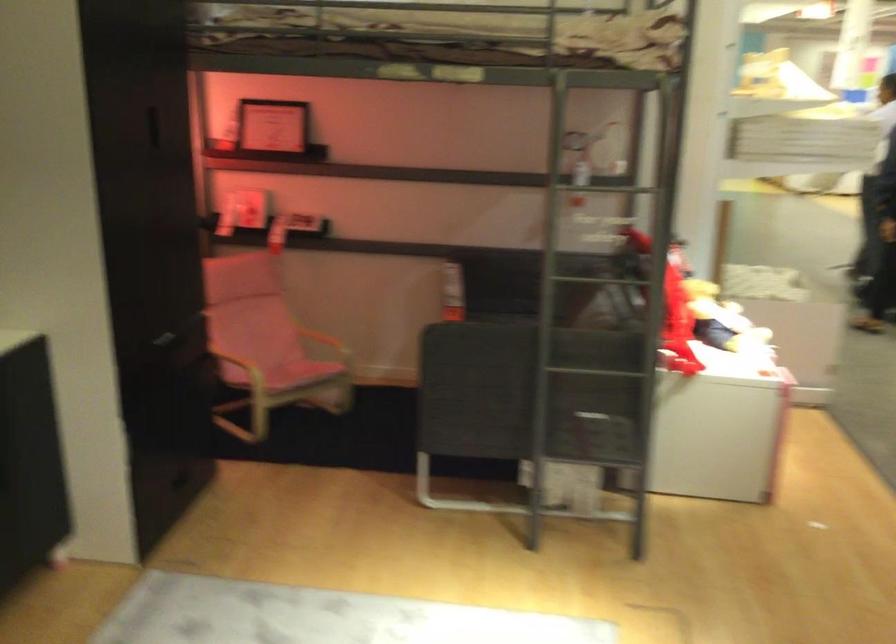
You are a GUI agent. You are given a task and a screenshot of the screen. Output one action in this format:
    pyautogui.click(x=<x>, y=<y>)
    Task: Click on the white bottle
    This screenshot has width=896, height=644.
    Given the screenshot: What is the action you would take?
    tap(452, 292)